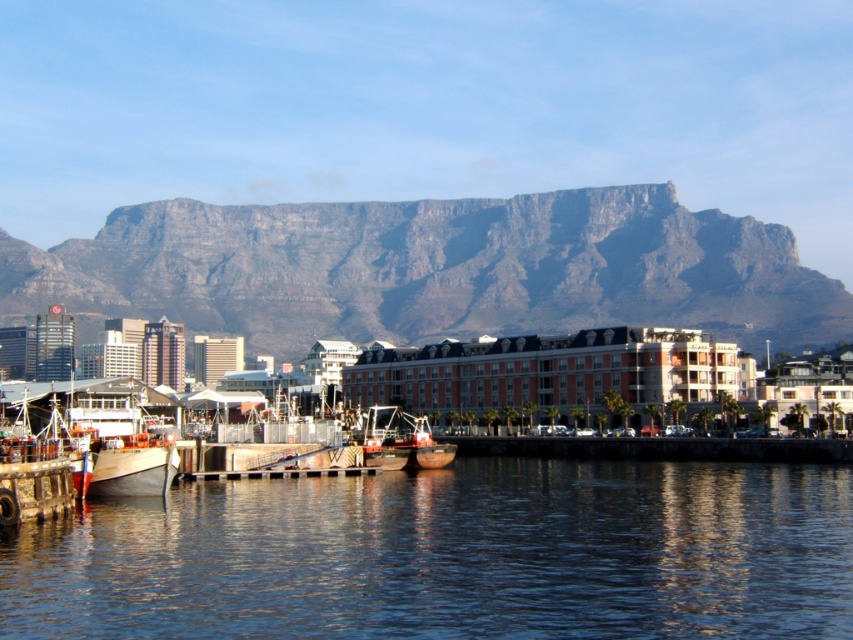
Does gray rocky mountain at upper center have a lesser width compared to metallic polished boat at center?

No, gray rocky mountain at upper center is not thinner than metallic polished boat at center.

Who is more forward, (256, 205) or (412, 451)?

Point (412, 451) is in front.

At what (x,y) coordinates should I click in order to perform the action: click on gray rocky mountain at upper center. Please return your answer as a coordinate pair (x, y). This screenshot has width=853, height=640. Looking at the image, I should click on (434, 269).

Is gray rocky mountain at upper center positioned in front of metallic gray boat at lower left?

No, it is not.

Is gray rocky mountain at upper center taller than metallic gray boat at lower left?

Correct, gray rocky mountain at upper center is much taller as metallic gray boat at lower left.

Does point (399, 320) come in front of point (146, 464)?

No, it is not.

Identify the location of gray rocky mountain at upper center. The width and height of the screenshot is (853, 640). (434, 269).

Between blue water at lower center and metallic gray boat at lower left, which one is positioned higher?

metallic gray boat at lower left is above.

Is point (469, 497) behind point (86, 392)?

No, it is in front of (86, 392).

Where is `blue water at lower center`? The image size is (853, 640). blue water at lower center is located at coordinates (451, 556).

Locate an element on the screen. The width and height of the screenshot is (853, 640). blue water at lower center is located at coordinates (451, 556).